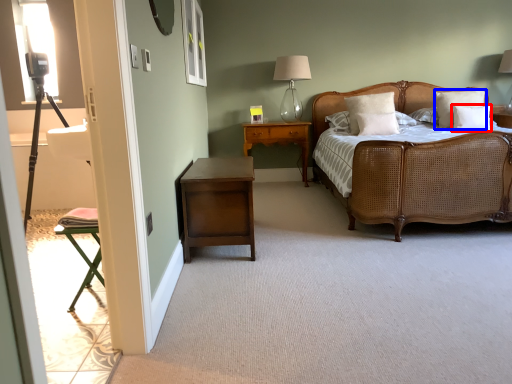
Question: Which object is further to the camera taking this photo, pillow (highlighted by a red box) or pillow (highlighted by a blue box)?

Choices:
 (A) pillow
 (B) pillow

Answer: (B)